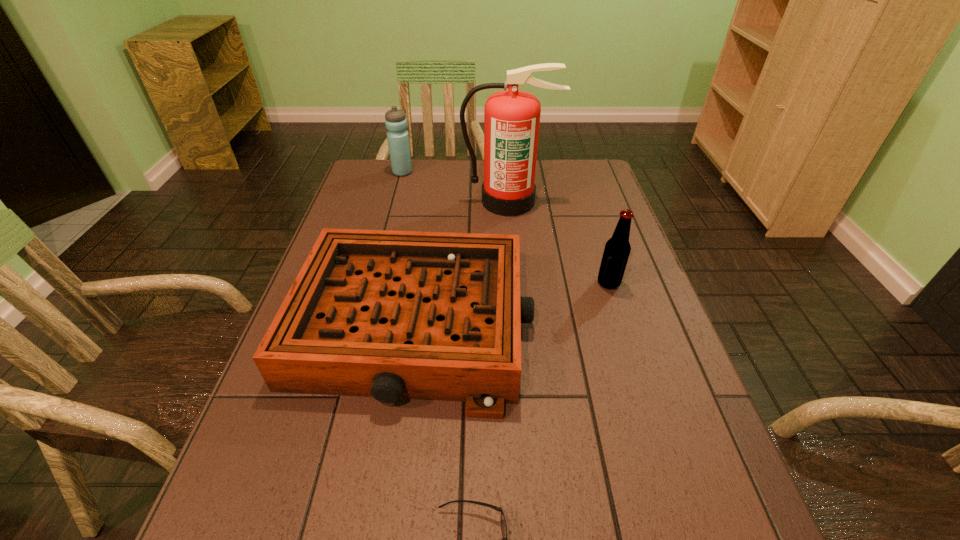
Locate an element on the screen. This screenshot has width=960, height=540. free space that is in between the fourth nearest object and the beer bottle is located at coordinates (559, 242).

Image resolution: width=960 pixels, height=540 pixels. In order to click on free area in between the rightmost object and the water bottle in this screenshot , I will do `click(506, 228)`.

I want to click on vacant space in between the second farthest object and the water bottle, so click(x=456, y=187).

This screenshot has height=540, width=960. In order to click on unoccupied position between the fire extinguisher and the water bottle in this screenshot , I will do coord(456,187).

What are the coordinates of `the closest object to the second farthest object` in the screenshot? It's located at (395, 120).

Image resolution: width=960 pixels, height=540 pixels. I want to click on object that is the fourth closest one to the tallest object, so click(502, 520).